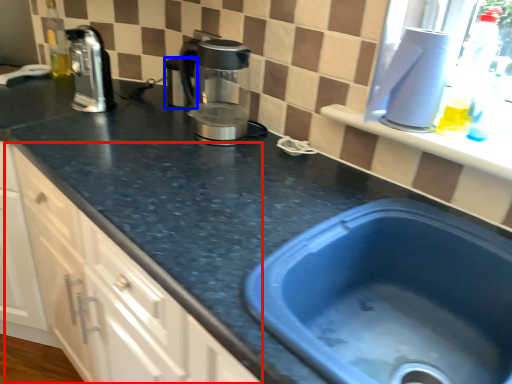
Question: Which object appears farthest to the camera in this image, cabinetry (highlighted by a red box) or appliance (highlighted by a blue box)?

Choices:
 (A) cabinetry
 (B) appliance

Answer: (B)